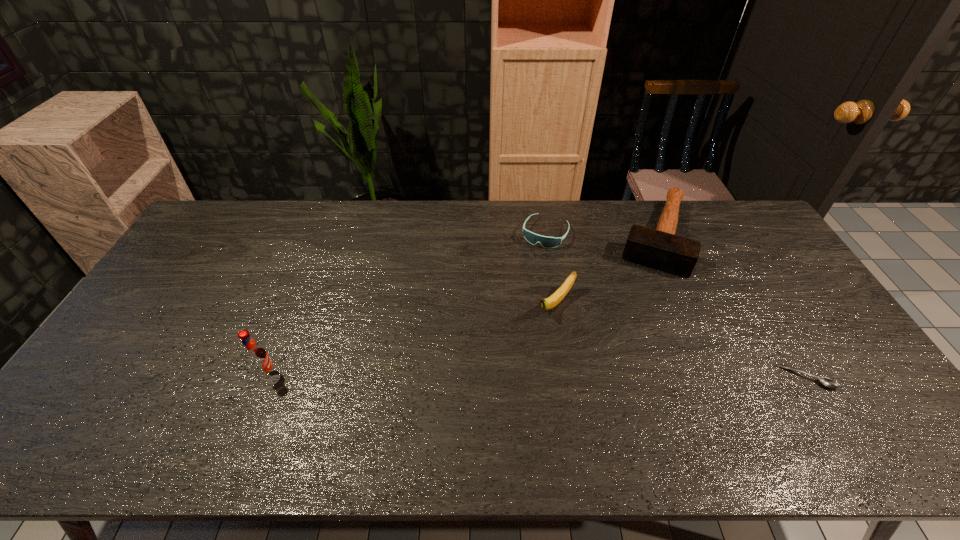
Where is `blank area in the image that satisfies the following two spatial constraints: 1. on the front side of the goggles; 2. on the left side of the mallet`? The height and width of the screenshot is (540, 960). blank area in the image that satisfies the following two spatial constraints: 1. on the front side of the goggles; 2. on the left side of the mallet is located at coordinates (545, 237).

Identify the location of vacant space that satisfies the following two spatial constraints: 1. on the back side of the banana; 2. on the left side of the leftmost object. The height and width of the screenshot is (540, 960). (296, 303).

Where is `free space in the image that satisfies the following two spatial constraints: 1. on the back side of the second shortest object; 2. on the right side of the tallest object`? free space in the image that satisfies the following two spatial constraints: 1. on the back side of the second shortest object; 2. on the right side of the tallest object is located at coordinates (324, 233).